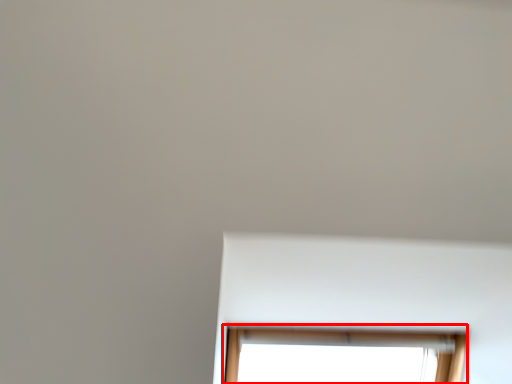
Question: Observing the image, what is the correct spatial positioning of window (annotated by the red box) in reference to bay window?

Choices:
 (A) right
 (B) left

Answer: (B)